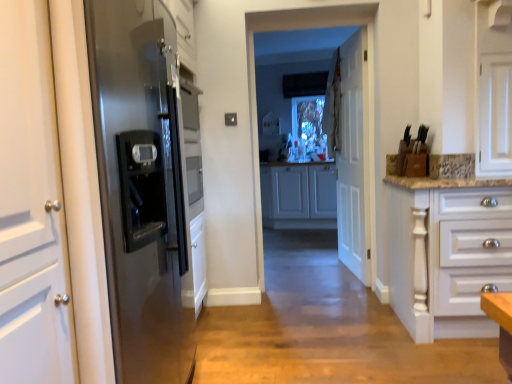
Question: Does white glossy drawer at right, which is counted as the first cabinetry, starting from the front, have a lesser height compared to stainless steel refrigerator at left?

Choices:
 (A) yes
 (B) no

Answer: (A)

Question: Are white glossy drawer at right, which is counted as the first cabinetry, starting from the front, and stainless steel refrigerator at left located far from each other?

Choices:
 (A) yes
 (B) no

Answer: (A)

Question: From the image's perspective, is white glossy drawer at right, which is counted as the first cabinetry, starting from the front, under stainless steel refrigerator at left?

Choices:
 (A) yes
 (B) no

Answer: (A)

Question: From a real-world perspective, is white glossy drawer at right, which is counted as the first cabinetry, starting from the front, below stainless steel refrigerator at left?

Choices:
 (A) yes
 (B) no

Answer: (A)

Question: Is white glossy drawer at right, which is counted as the first cabinetry, starting from the front, at the right side of stainless steel refrigerator at left?

Choices:
 (A) no
 (B) yes

Answer: (B)

Question: Is stainless steel refrigerator at left at the back of white glossy drawer at right, which is counted as the first cabinetry, starting from the front?

Choices:
 (A) no
 (B) yes

Answer: (A)

Question: Is stainless steel refrigerator at left surrounding white matte cabinet at center, which ranks as the 1th cabinetry in back-to-front order?

Choices:
 (A) yes
 (B) no

Answer: (B)

Question: From a real-world perspective, is stainless steel refrigerator at left under white matte cabinet at center, acting as the 2th cabinetry starting from the front?

Choices:
 (A) no
 (B) yes

Answer: (A)

Question: Considering the relative sizes of stainless steel refrigerator at left and white matte cabinet at center, which ranks as the 1th cabinetry in back-to-front order, in the image provided, is stainless steel refrigerator at left smaller than white matte cabinet at center, which ranks as the 1th cabinetry in back-to-front order,?

Choices:
 (A) yes
 (B) no

Answer: (B)

Question: Is stainless steel refrigerator at left outside white matte cabinet at center, acting as the 2th cabinetry starting from the front?

Choices:
 (A) yes
 (B) no

Answer: (A)

Question: Does stainless steel refrigerator at left have a larger size compared to white matte cabinet at center, which ranks as the 1th cabinetry in back-to-front order?

Choices:
 (A) yes
 (B) no

Answer: (A)

Question: Is stainless steel refrigerator at left not near white matte cabinet at center, acting as the 2th cabinetry starting from the front?

Choices:
 (A) yes
 (B) no

Answer: (A)

Question: Is white matte cabinet at center, acting as the 2th cabinetry starting from the front, oriented away from clear glass window at center?

Choices:
 (A) no
 (B) yes

Answer: (A)